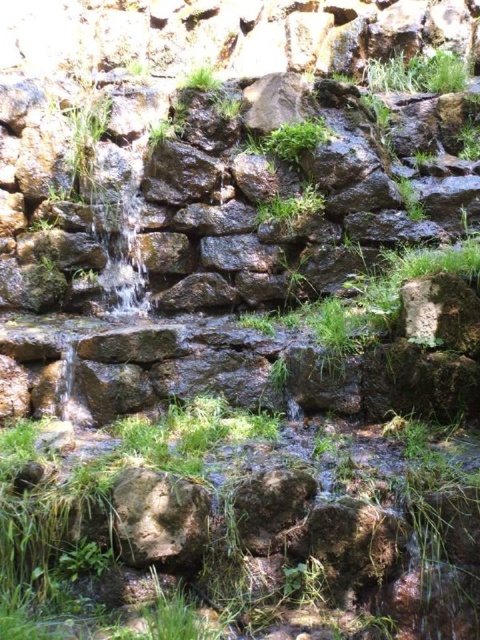
Who is positioned more to the left, green grassy at lower center or rough textured rock at center?

rough textured rock at center

Does green grassy at lower center appear on the left side of rough textured rock at center?

Incorrect, green grassy at lower center is not on the left side of rough textured rock at center.

Which is in front, point (468, 602) or point (200, 557)?

Point (468, 602) is more forward.

The image size is (480, 640). I want to click on green grassy at lower center, so (x=247, y=529).

Between rough textured rock at center and green leafy grass at center, which one has more height?

rough textured rock at center

Between rough textured rock at center and green leafy grass at center, which one appears on the left side from the viewer's perspective?

rough textured rock at center

Between point (196, 525) and point (307, 209), which one is positioned behind?

The point (307, 209) is more distant.

Where is `rough textured rock at center`? rough textured rock at center is located at coordinates (158, 518).

Based on the photo, does green grassy at lower center come in front of green leafy grass at center?

Yes.

Does green grassy at lower center appear on the right side of green leafy grass at center?

Incorrect, green grassy at lower center is not on the right side of green leafy grass at center.

You are a GUI agent. You are given a task and a screenshot of the screen. Output one action in this format:
    pyautogui.click(x=<x>, y=<y>)
    Task: Click on the green grassy at lower center
    
    Given the screenshot: What is the action you would take?
    pyautogui.click(x=247, y=529)